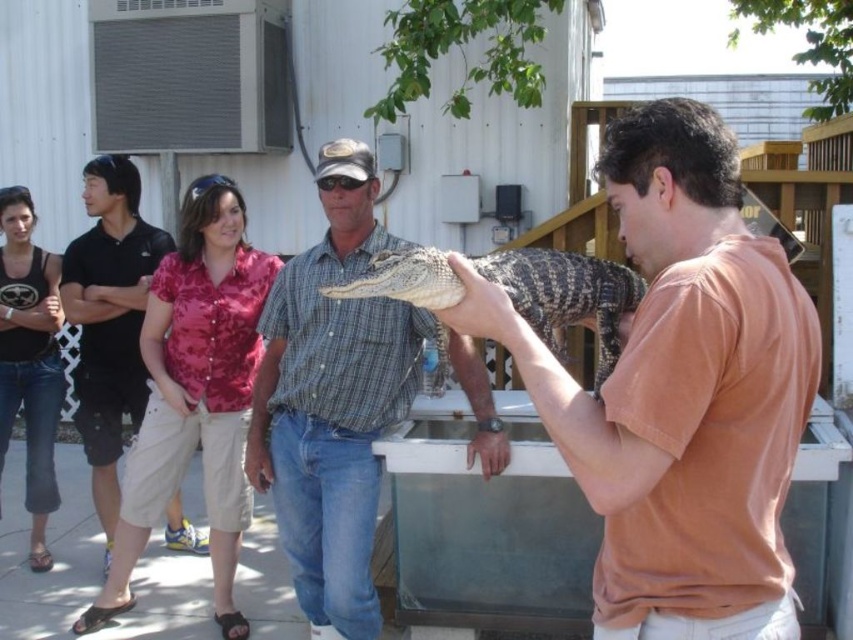
Question: Which object is farther from the camera taking this photo?

Choices:
 (A) black cotton shirt at left
 (B) checkered shirt at center
 (C) matte orange t-shirt at center

Answer: (A)

Question: Is the position of checkered shirt at center less distant than that of black cotton shirt at left?

Choices:
 (A) no
 (B) yes

Answer: (B)

Question: Can you confirm if matte orange t-shirt at center is thinner than black cotton shirt at left?

Choices:
 (A) no
 (B) yes

Answer: (A)

Question: Among these objects, which one is nearest to the camera?

Choices:
 (A) matte orange t-shirt at center
 (B) checkered shirt at center
 (C) black cotton shirt at left
 (D) shiny brown alligator at center

Answer: (A)

Question: Which point is farther to the camera?

Choices:
 (A) (460, 285)
 (B) (643, 624)
 (C) (251, 474)
 (D) (167, 529)

Answer: (D)

Question: Can you confirm if matte orange t-shirt at center is positioned to the left of shiny brown alligator at center?

Choices:
 (A) no
 (B) yes

Answer: (A)